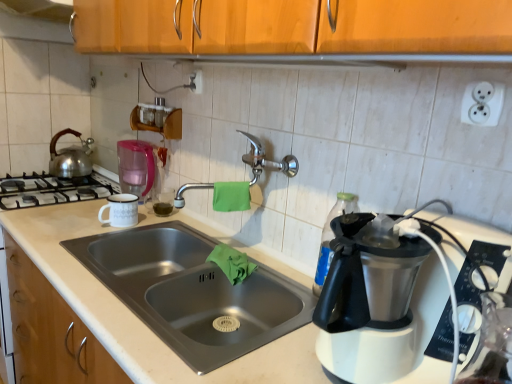
Question: From the image's perspective, is satin nickel faucet at center under transparent plastic bottle at right?

Choices:
 (A) no
 (B) yes

Answer: (A)

Question: Can you confirm if satin nickel faucet at center is taller than transparent plastic bottle at right?

Choices:
 (A) no
 (B) yes

Answer: (A)

Question: From a real-world perspective, is satin nickel faucet at center positioned over transparent plastic bottle at right based on gravity?

Choices:
 (A) no
 (B) yes

Answer: (B)

Question: Considering the relative positions of satin nickel faucet at center and transparent plastic bottle at right in the image provided, is satin nickel faucet at center in front of transparent plastic bottle at right?

Choices:
 (A) yes
 (B) no

Answer: (B)

Question: Is there a large distance between satin nickel faucet at center and transparent plastic bottle at right?

Choices:
 (A) yes
 (B) no

Answer: (B)

Question: Would you say green fabric towel at center, acting as the 1th material starting from the top, is to the left or to the right of wooden cabinet at upper center in the picture?

Choices:
 (A) right
 (B) left

Answer: (A)

Question: Is point pyautogui.click(x=246, y=190) closer or farther from the camera than point pyautogui.click(x=48, y=8)?

Choices:
 (A) farther
 (B) closer

Answer: (B)

Question: Is green fabric towel at center, acting as the 1th material starting from the top, wider or thinner than wooden cabinet at upper center?

Choices:
 (A) wide
 (B) thin

Answer: (B)

Question: Considering the positions of green fabric towel at center, acting as the 1th material starting from the top, and wooden cabinet at upper center in the image, is green fabric towel at center, acting as the 1th material starting from the top, taller or shorter than wooden cabinet at upper center?

Choices:
 (A) tall
 (B) short

Answer: (B)

Question: From a real-world perspective, is green cloth at sink, which is the 2th material from top to bottom, positioned above or below wooden cabinet at upper center?

Choices:
 (A) below
 (B) above

Answer: (A)

Question: From the image's perspective, is green cloth at sink, which is the 2th material from top to bottom, positioned above or below wooden cabinet at upper center?

Choices:
 (A) above
 (B) below

Answer: (B)

Question: In terms of size, does green cloth at sink, which ranks as the first material in bottom-to-top order, appear bigger or smaller than wooden cabinet at upper center?

Choices:
 (A) small
 (B) big

Answer: (A)

Question: In terms of height, does green cloth at sink, which ranks as the first material in bottom-to-top order, look taller or shorter compared to wooden cabinet at upper center?

Choices:
 (A) tall
 (B) short

Answer: (B)

Question: In terms of size, does silver metallic kettle at left appear bigger or smaller than green cloth at sink, which ranks as the first material in bottom-to-top order?

Choices:
 (A) small
 (B) big

Answer: (B)

Question: In terms of width, does silver metallic kettle at left look wider or thinner when compared to green cloth at sink, which ranks as the first material in bottom-to-top order?

Choices:
 (A) wide
 (B) thin

Answer: (A)